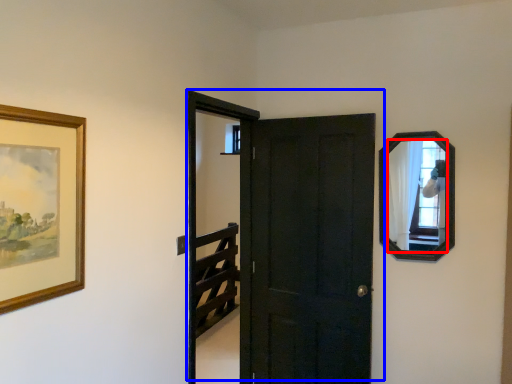
Question: Which point is further to the camera, mirror (highlighted by a red box) or door (highlighted by a blue box)?

Choices:
 (A) mirror
 (B) door

Answer: (B)